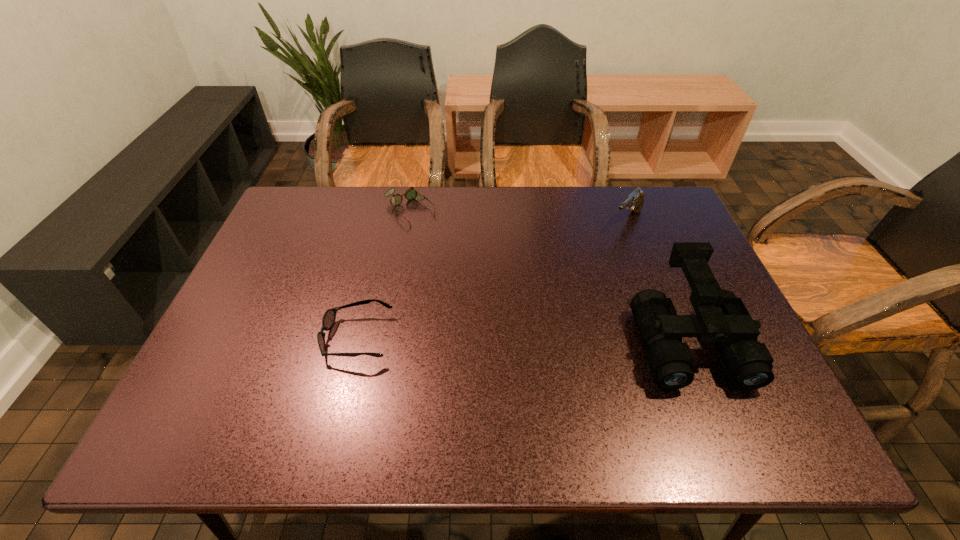
Find the location of a particular element. This screenshot has width=960, height=540. vacant space on the desktop that is between the sunglasses and the tallest object and is positioned at the barrel of the second tallest object is located at coordinates (510, 338).

The image size is (960, 540). I want to click on vacant space on the desktop that is between the sunglasses and the tallest object and is positioned on the front-facing side of the spectacles, so click(535, 339).